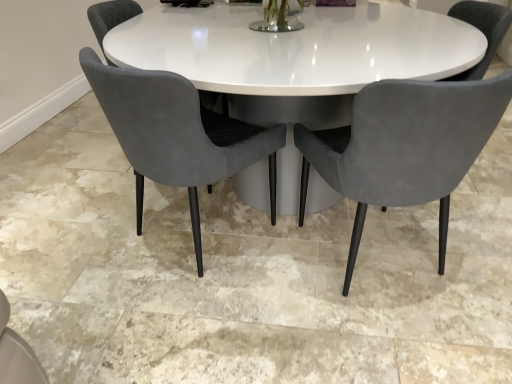
Question: Considering the positions of point (90, 11) and point (161, 120), is point (90, 11) closer or farther from the camera than point (161, 120)?

Choices:
 (A) farther
 (B) closer

Answer: (A)

Question: Is velvet grey chair at center, arranged as the 3th chair when viewed from the right, taller or shorter than velvet grey chair at center, the 2th chair when ordered from left to right?

Choices:
 (A) short
 (B) tall

Answer: (A)

Question: Which is farther from the velvet grey chair at center, the 2th chair when ordered from left to right?

Choices:
 (A) velvet grey chair at center, the 1th chair positioned from the left
 (B) velvet grey chair at center, the 3th chair positioned from the left

Answer: (A)

Question: Estimate the real-world distances between objects in this image. Which object is closer to the velvet grey chair at center, which is counted as the 1th chair, starting from the right?

Choices:
 (A) velvet grey chair at center, which ranks as the second chair in right-to-left order
 (B) velvet grey chair at center, arranged as the 3th chair when viewed from the right

Answer: (A)